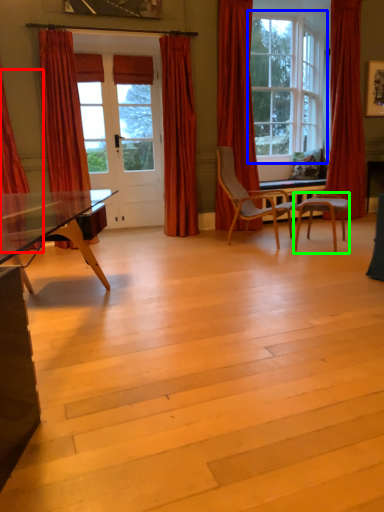
Question: Estimate the real-world distances between objects in this image. Which object is closer to curtain (highlighted by a red box), window (highlighted by a blue box) or chair (highlighted by a green box)?

Choices:
 (A) window
 (B) chair

Answer: (B)